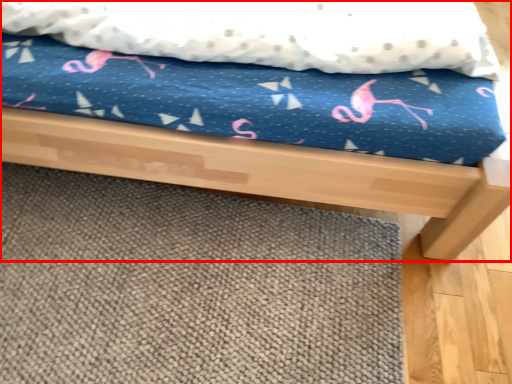
Question: From the image's perspective, considering the relative positions of bed (annotated by the red box) and mat in the image provided, where is bed (annotated by the red box) located with respect to the staircase?

Choices:
 (A) above
 (B) below

Answer: (A)